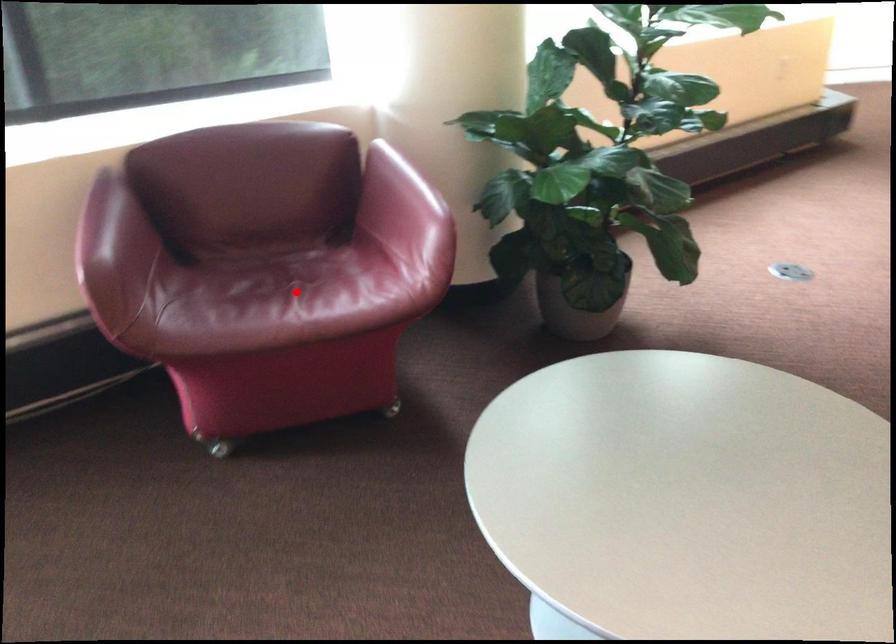
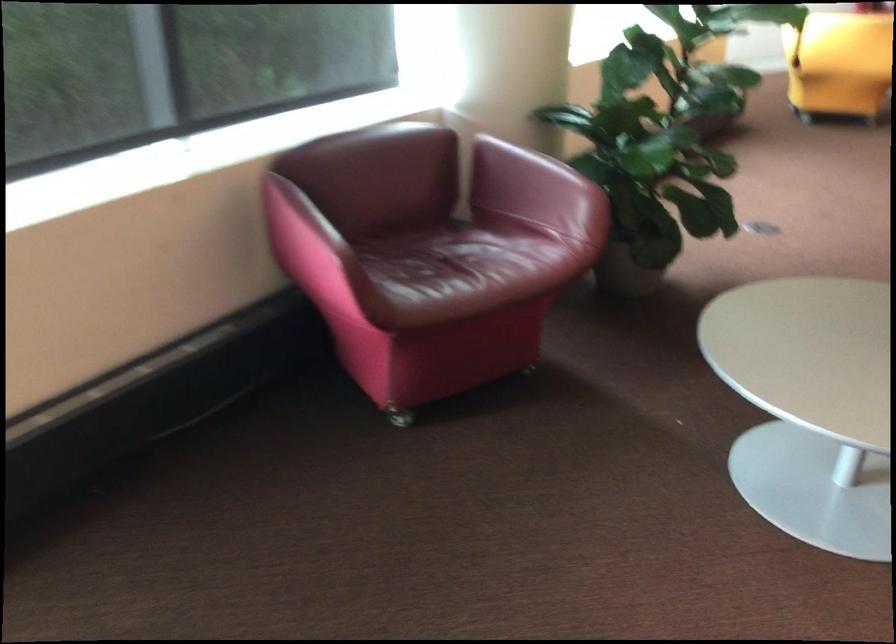
Find the pixel in the second image that matches the highlighted location in the first image.

(466, 266)